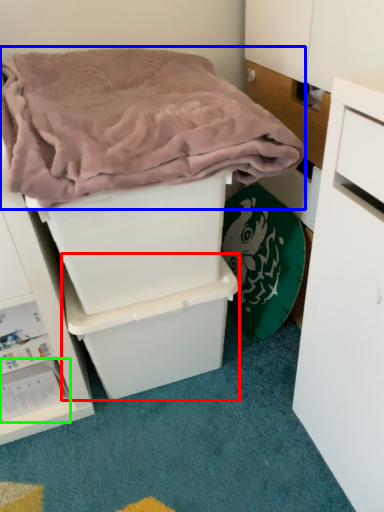
Question: Considering the real-world distances, which object is farthest from storage box (highlighted by a red box)? blanket (highlighted by a blue box) or storage box (highlighted by a green box)?

Choices:
 (A) blanket
 (B) storage box

Answer: (A)